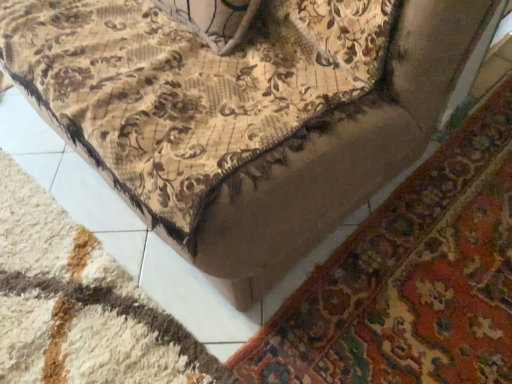
What are the coordinates of `vacant space to the right of beige textured mat at lower center, positioned as the 1th mat in left-to-right order` in the screenshot? It's located at (313, 281).